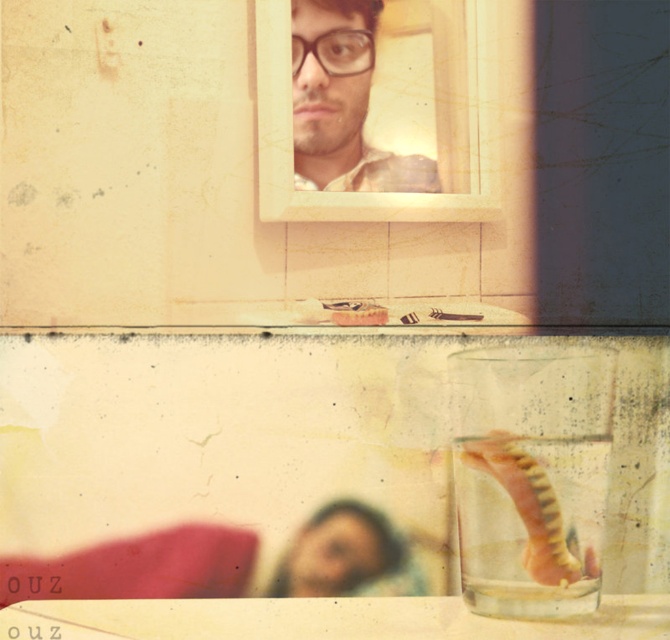
You are standing in front of a framed photograph and a point marked at coordinates (x=340, y=99). If you want to take a closer look at the point without moving your position, which object should you focus on?

The point marked at coordinates (x=340, y=99) is only 3.57 feet away from the camera, so you should focus on that point instead of the framed photograph to get a closer look.

You are a photographer planning to take a portrait using the smooth skin selfie at lower center and the matte plastic selfie at upper center as reference points. If your camera has a focal length of 50mm, what is the minimum distance you need to stand from the subjects to ensure both selfies are in frame?

To ensure both the smooth skin selfie at lower center and the matte plastic selfie at upper center are in frame with a 50mm focal length, the photographer must position themselves at least 16.39 inches away from the closest subject. This distance accounts for the spacing between the two selfies, ensuring they both fit within the camera frame.

You are standing in a room with a framed photograph on the wall and two points marked on the floor. The points are labeled as point (297,122) and point (375,568). If you want to move closer to the framed photograph, which point should you stand on?

You should stand on point (297,122) because it is closer to the framed photograph than point (375,568), as it is further to the viewer.